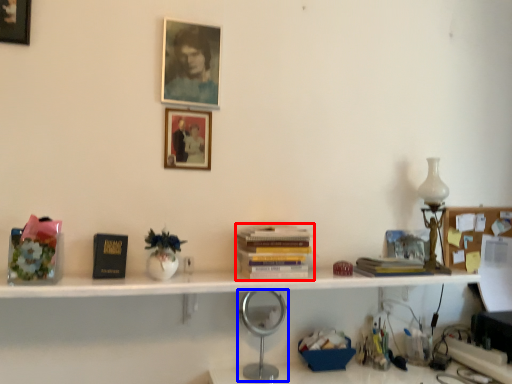
Question: Among these objects, which one is nearest to the camera, book (highlighted by a red box) or table lamp (highlighted by a blue box)?

Choices:
 (A) book
 (B) table lamp

Answer: (A)